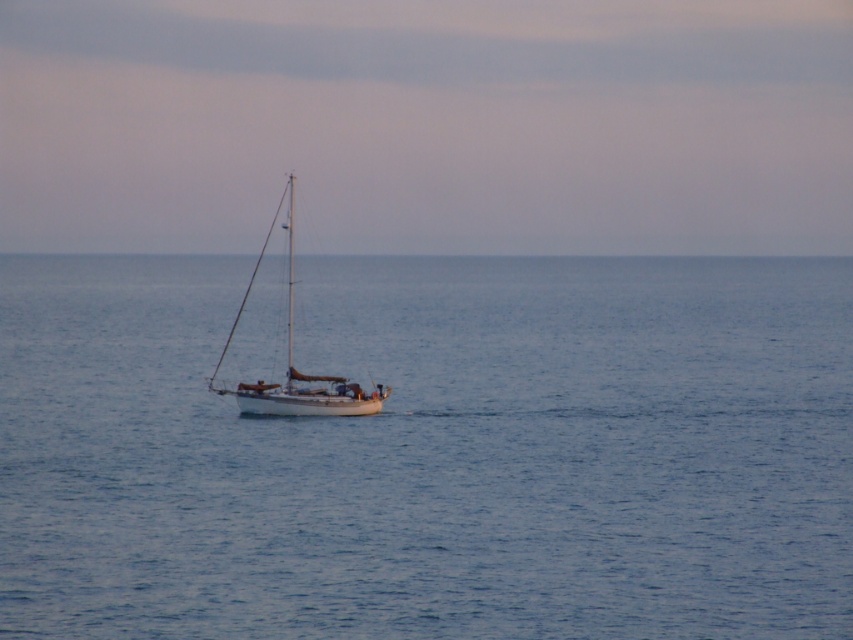
Question: Can you confirm if blue water at center is positioned to the left of white matte sailboat at center?

Choices:
 (A) no
 (B) yes

Answer: (A)

Question: Where is blue water at center located in relation to white matte sailboat at center in the image?

Choices:
 (A) right
 (B) left

Answer: (A)

Question: Among these objects, which one is farthest from the camera?

Choices:
 (A) white matte sailboat at center
 (B) blue water at center

Answer: (A)

Question: Does blue water at center have a lesser width compared to white matte sailboat at center?

Choices:
 (A) no
 (B) yes

Answer: (A)

Question: Which point is closer to the camera?

Choices:
 (A) (314, 392)
 (B) (642, 484)

Answer: (B)